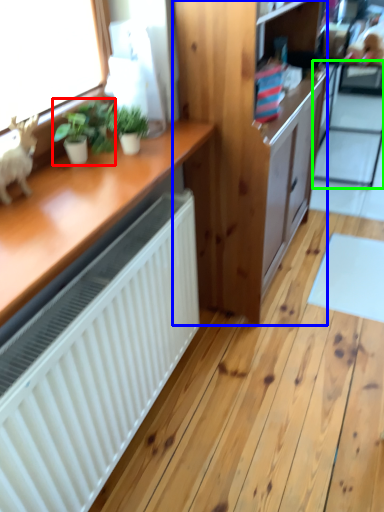
Question: Which object is positioned farthest from houseplant (highlighted by a red box)? Select from cabinetry (highlighted by a blue box) and screen door (highlighted by a green box).

Choices:
 (A) cabinetry
 (B) screen door

Answer: (B)